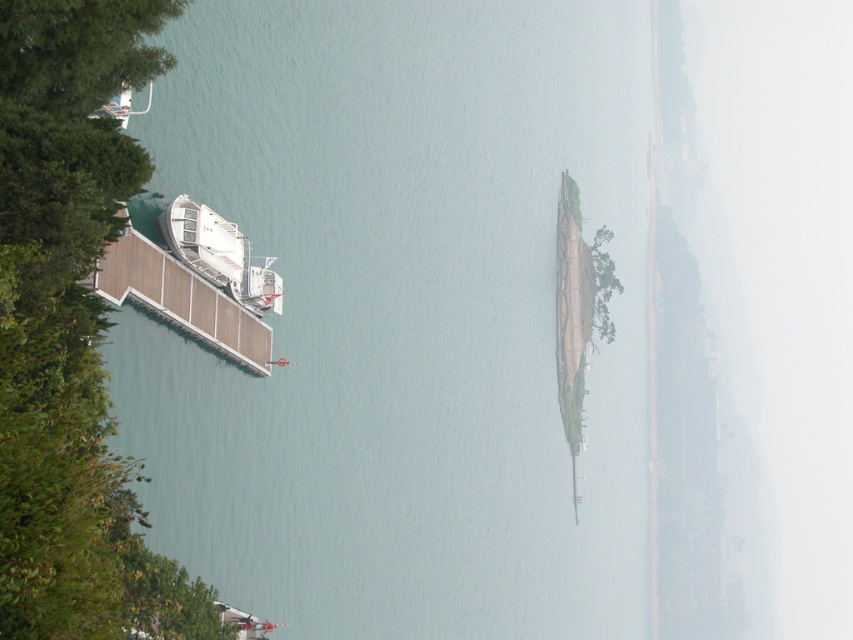
Can you confirm if green leafy tree at left is shorter than wooden dock at left?

Incorrect, green leafy tree at left's height does not fall short of wooden dock at left's.

Who is taller, green leafy tree at left or wooden dock at left?

With more height is green leafy tree at left.

What do you see at coordinates (71, 332) in the screenshot? Image resolution: width=853 pixels, height=640 pixels. I see `green leafy tree at left` at bounding box center [71, 332].

Where is `green leafy tree at left`? This screenshot has width=853, height=640. green leafy tree at left is located at coordinates (71, 332).

Consider the image. Who is higher up, green leafy tree at left or white glossy boat at upper left?

Positioned higher is white glossy boat at upper left.

Does green leafy tree at left come behind white glossy boat at upper left?

That is False.

Is point (73, 29) more distant than point (102, 106)?

No, (73, 29) is in front of (102, 106).

Locate an element on the screen. green leafy tree at left is located at coordinates (71, 332).

Does clear blue water at left come behind green leafy tree at left?

Yes.

Which is below, clear blue water at left or green leafy tree at left?

green leafy tree at left

This screenshot has height=640, width=853. I want to click on clear blue water at left, so click(x=403, y=316).